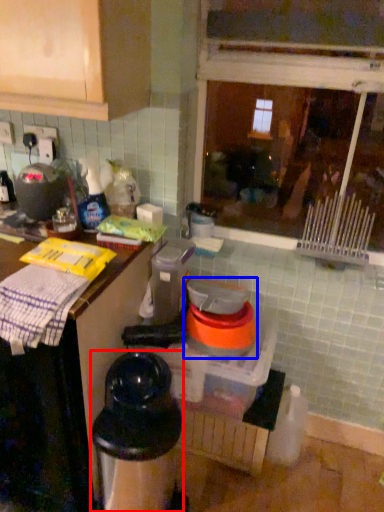
Question: Which of the following is the closest to the observer, appliance (highlighted by a red box) or appliance (highlighted by a blue box)?

Choices:
 (A) appliance
 (B) appliance

Answer: (A)